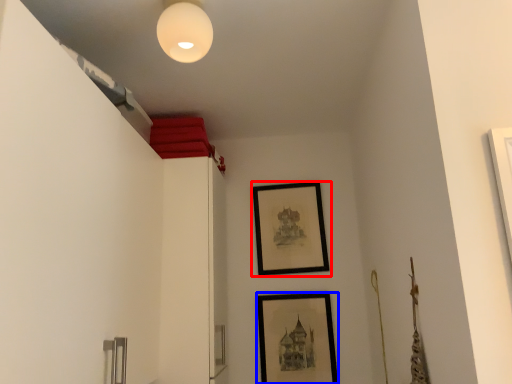
Question: Which object is further to the camera taking this photo, picture frame (highlighted by a red box) or picture frame (highlighted by a blue box)?

Choices:
 (A) picture frame
 (B) picture frame

Answer: (A)